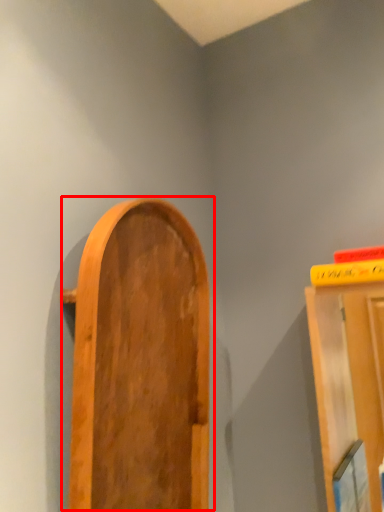
Question: From the image's perspective, what is the correct spatial positioning of door (annotated by the red box) in reference to book?

Choices:
 (A) below
 (B) above

Answer: (A)